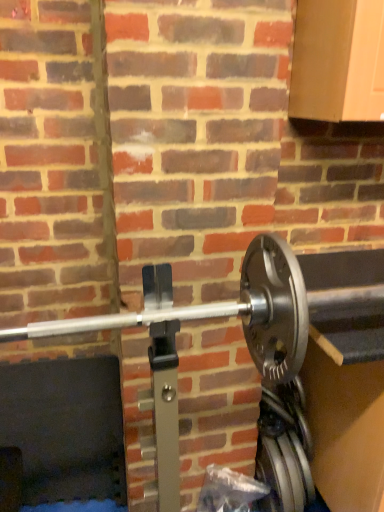
Question: Should I look upward or downward to see silver metallic weight at center-right?

Choices:
 (A) down
 (B) up

Answer: (A)